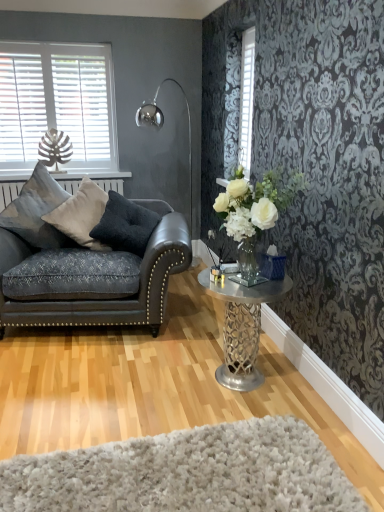
Image resolution: width=384 pixels, height=512 pixels. I want to click on free region under white glass vase at center right (from a real-world perspective), so click(251, 283).